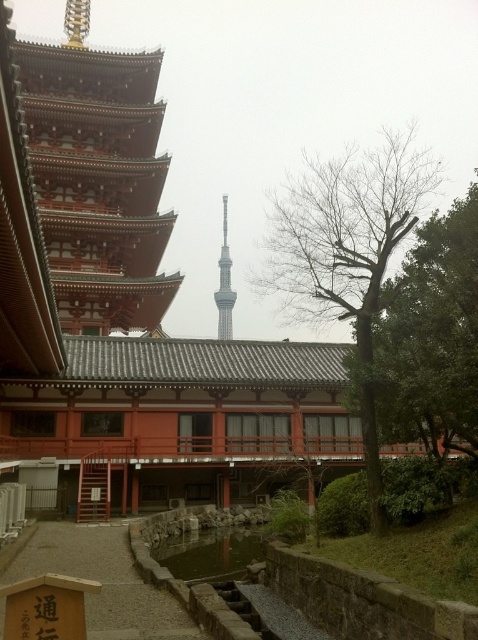
Can you confirm if wooden sign at lower left is shorter than smooth glass tower at center?

Correct, wooden sign at lower left is not as tall as smooth glass tower at center.

Image resolution: width=478 pixels, height=640 pixels. I want to click on wooden sign at lower left, so click(105, 580).